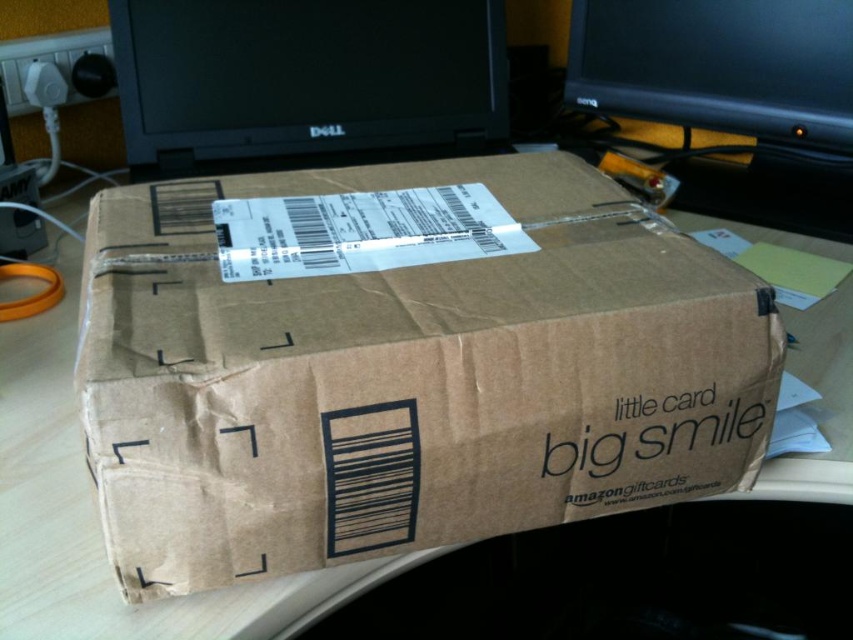
You are a delivery person who needs to place the Amazon giftcard box on the desk without blocking the camera. The box requires 100 centimeters of space to be placed safely. Is there enough space between the black glossy monitor at upper center and the camera to place the box?

The black glossy monitor at upper center and camera are 99.99 centimeters apart. Since the box requires 100 centimeters of space, there is not enough space to place the box safely between them.

You are organizing your desk and want to move the brown cardboard box at center to the left side of the desk. However, there is a black glossy monitor at upper right in the way. Can you move the box without moving the monitor?

The brown cardboard box at center is closer to the viewer than the black glossy monitor at upper right, so you can move the box without moving the monitor since it is in front of the monitor.